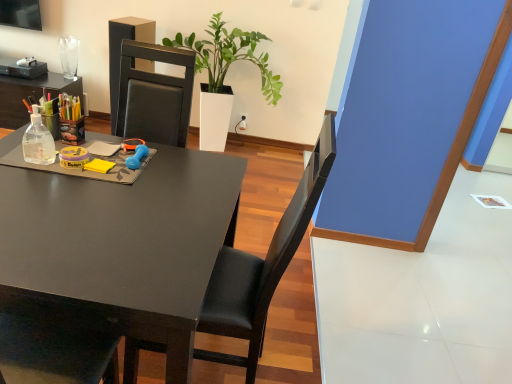
Question: Is black leather chair at center situated inside white glossy planter at center or outside?

Choices:
 (A) outside
 (B) inside

Answer: (A)

Question: Would you say black leather chair at center is to the left or to the right of white glossy planter at center in the picture?

Choices:
 (A) right
 (B) left

Answer: (A)

Question: Based on their relative distances, which object is farther from the white glossy planter at center?

Choices:
 (A) matte black desk at center
 (B) black leather chair at center

Answer: (B)

Question: Which is nearer to the matte black desk at center?

Choices:
 (A) white glossy planter at center
 (B) black leather chair at center

Answer: (B)